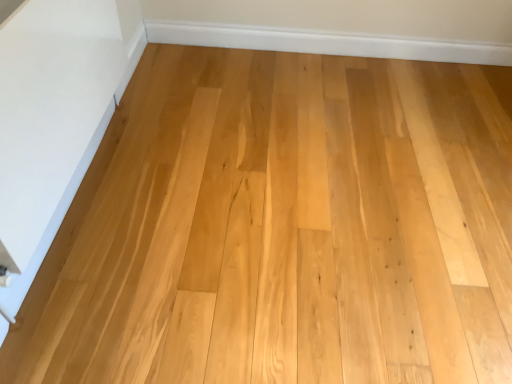
Describe the element at coordinates (326, 42) in the screenshot. This screenshot has width=512, height=384. I see `natural wood floor at upper center` at that location.

I want to click on natural wood floor at upper center, so click(x=326, y=42).

Identify the location of natural wood floor at upper center. (326, 42).